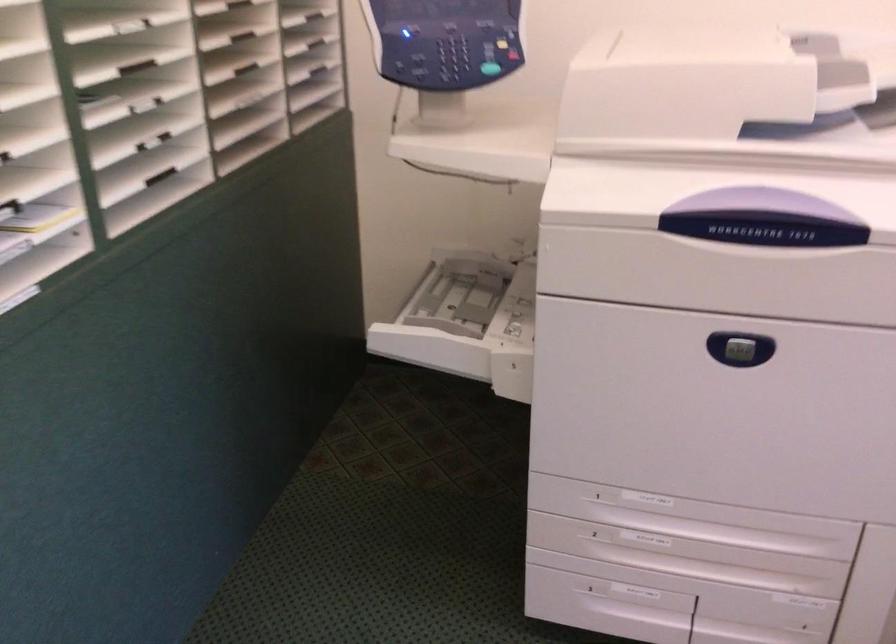
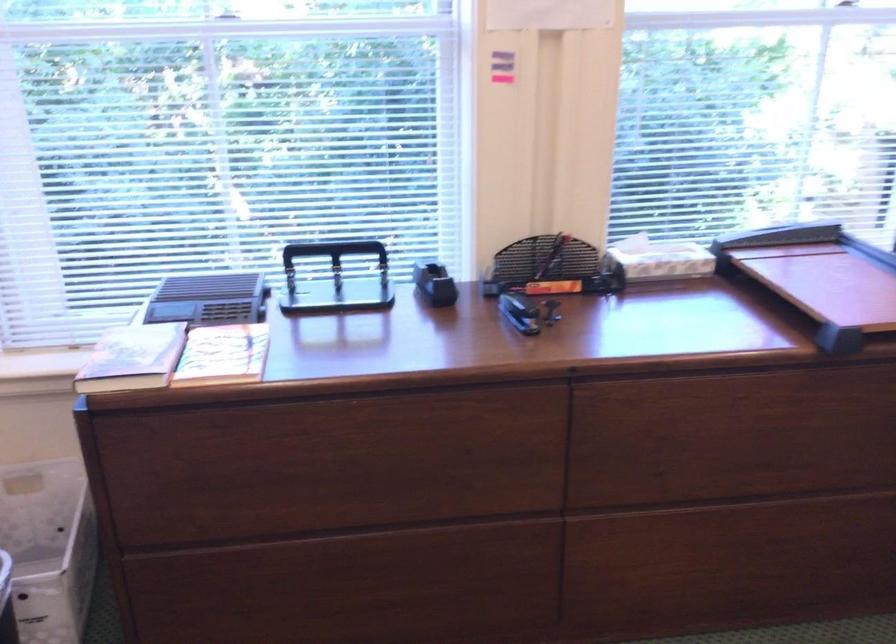
First-person continuous shooting, in which direction is the camera rotating?

The camera's rotation is toward right-down.